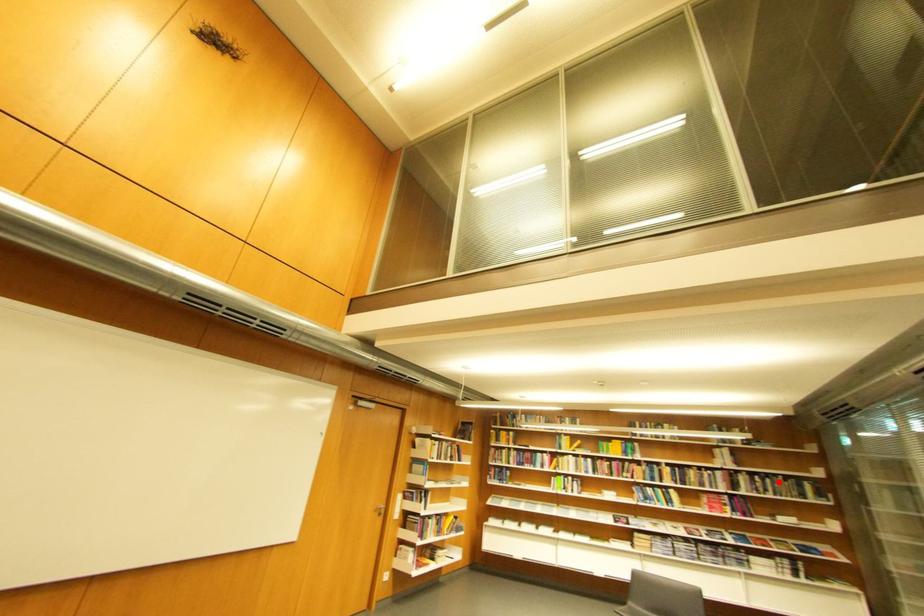
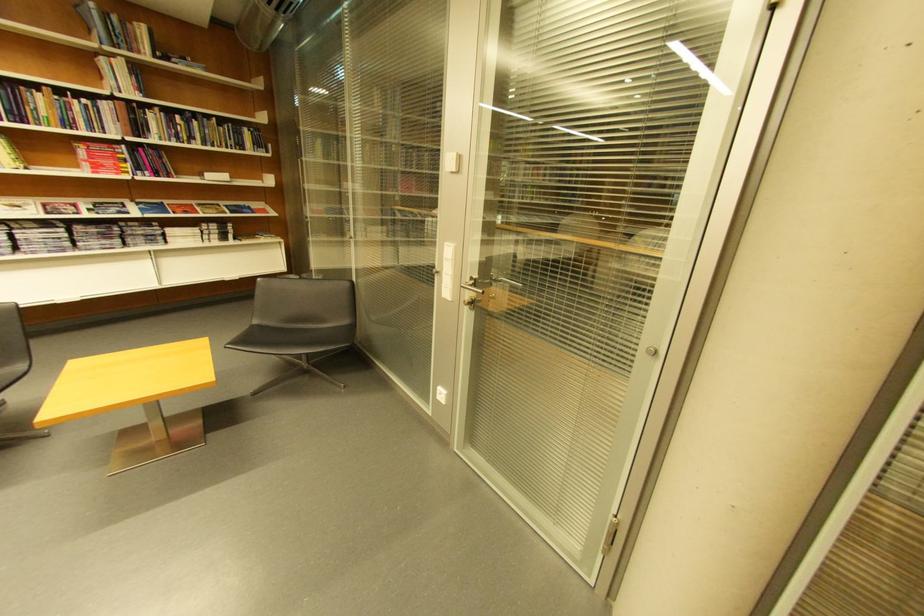
Question: A red point is marked in image1. In image2, is the corresponding 3D point closer to the camera or farther? Reply with the corresponding letter.

Choices:
 (A) The corresponding 3D point is closer.
 (B) The corresponding 3D point is farther.

Answer: (B)